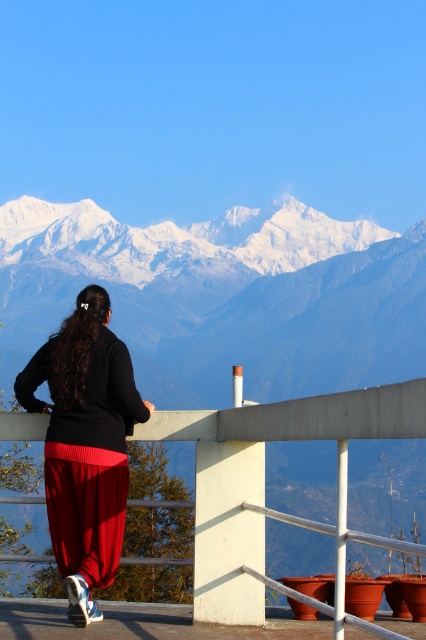
Question: Among these objects, which one is nearest to the camera?

Choices:
 (A) matte black sweater at center
 (B) concrete at center

Answer: (B)

Question: Can you confirm if concrete at center is positioned to the right of matte black sweater at center?

Choices:
 (A) no
 (B) yes

Answer: (B)

Question: Which of the following is the farthest from the observer?

Choices:
 (A) matte black sweater at center
 (B) concrete at center

Answer: (A)

Question: Is concrete at center bigger than matte black sweater at center?

Choices:
 (A) no
 (B) yes

Answer: (B)

Question: Is concrete at center below matte black sweater at center?

Choices:
 (A) yes
 (B) no

Answer: (B)